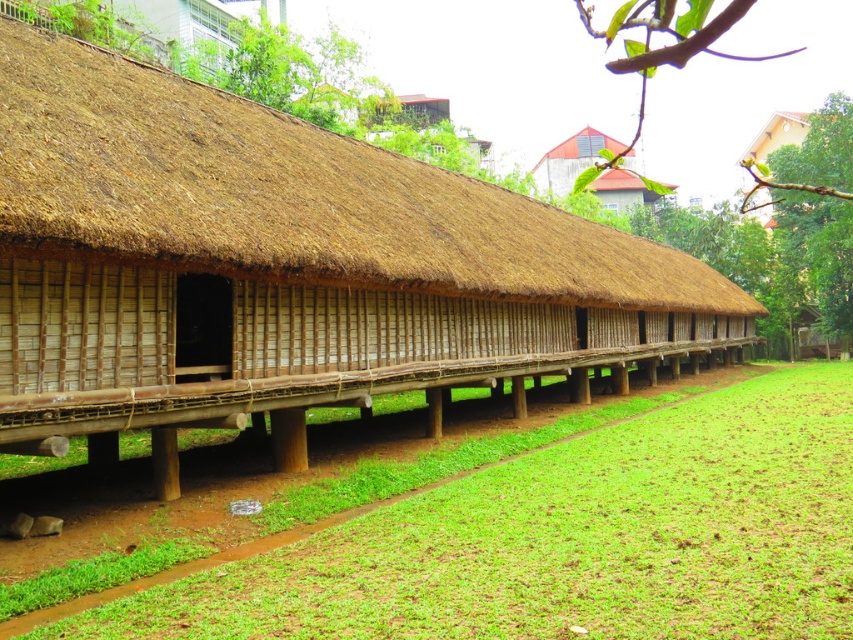
You are a gardener who wants to plant flowers in the green grass at lower center. Considering the height of the matte brown thatched roof hut at upper center, will the flowers be visible once they grow to their full height?

The green grass at lower center is not as tall as the matte brown thatched roof hut at upper center. Once the flowers grow to their full height, they will still be shorter than the hut, so they will be visible.

You are standing in front of the traditional building and want to walk towards the two points marked on the ground. Which point, point (660, 300) or point (636, 179), will you reach first?

Point (660, 300) is closer to the camera than point (636, 179), so you will reach point (660, 300) first.